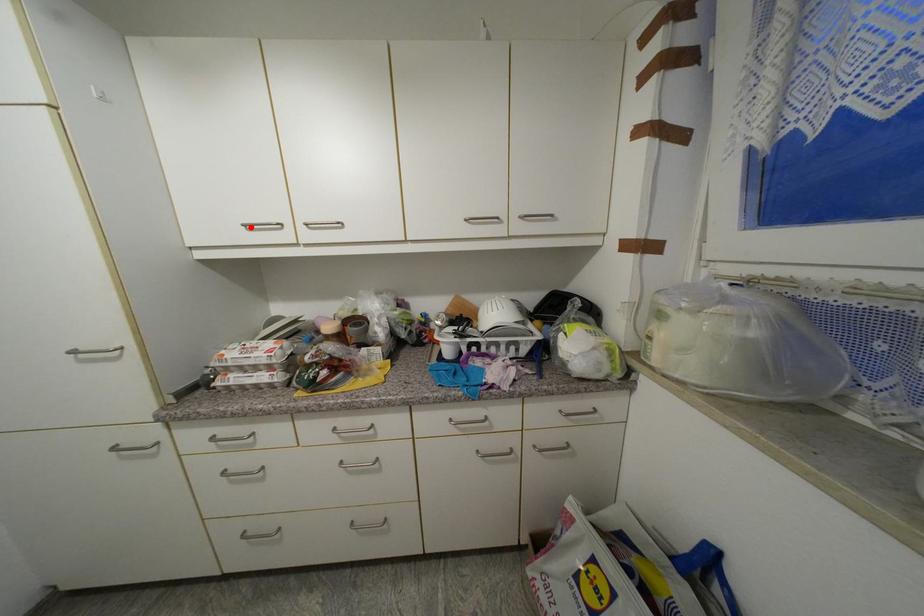
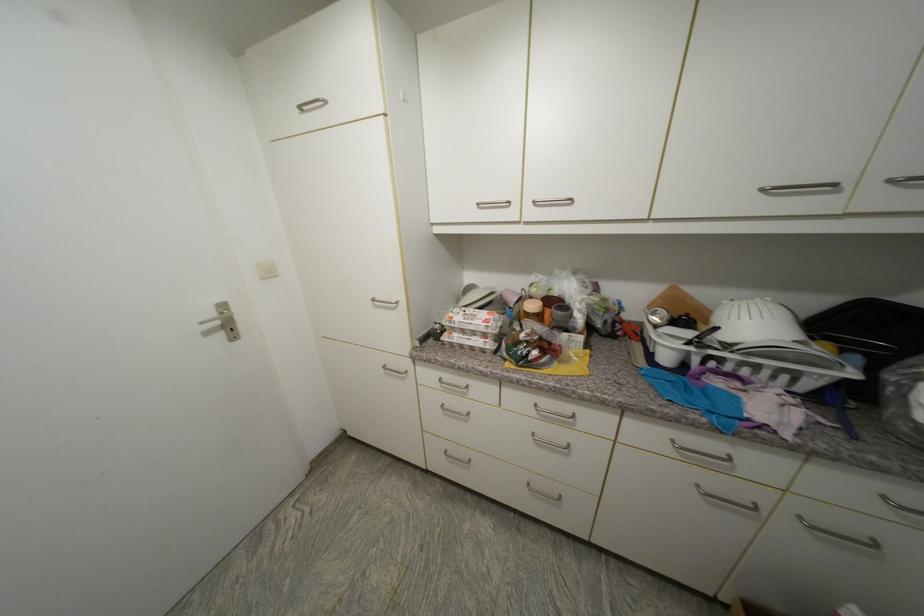
Locate, in the second image, the point that corresponds to the highlighted location in the first image.

(483, 206)